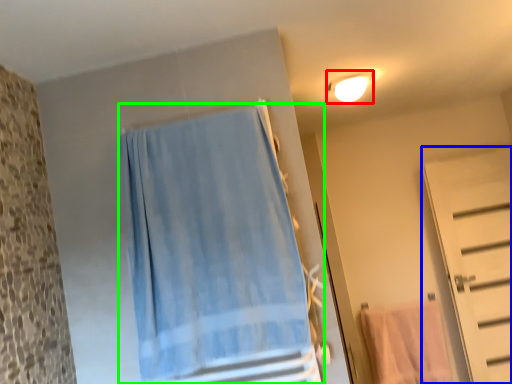
Question: Based on their relative distances, which object is nearer to light fixture (highlighted by a red box)? Choose from door (highlighted by a blue box) and curtain (highlighted by a green box).

Choices:
 (A) door
 (B) curtain

Answer: (B)